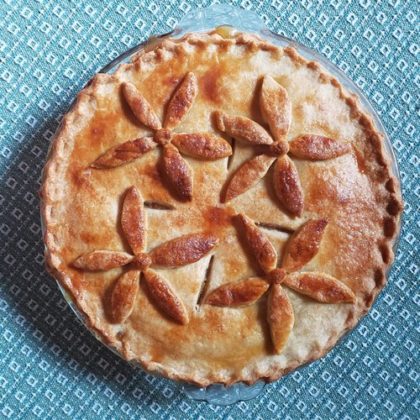
At what (x,y) coordinates should I click in order to perform the action: click on blue table cloth right side. Please return your answer as a coordinate pair (x, y). The image size is (420, 420). Looking at the image, I should click on (406, 311), (408, 119).